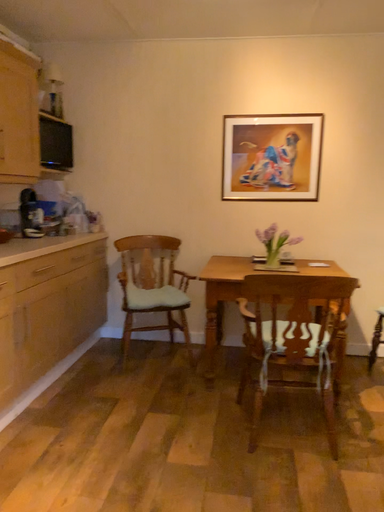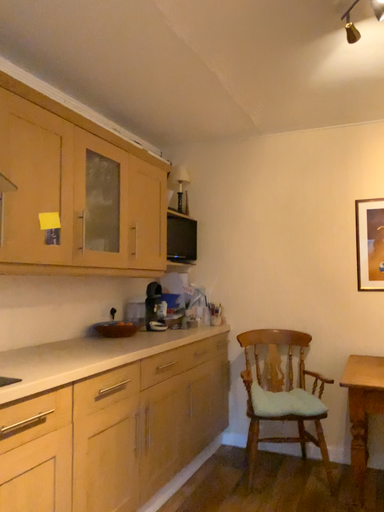
Question: Which way did the camera rotate in the video?

Choices:
 (A) rotated downward
 (B) rotated upward

Answer: (B)